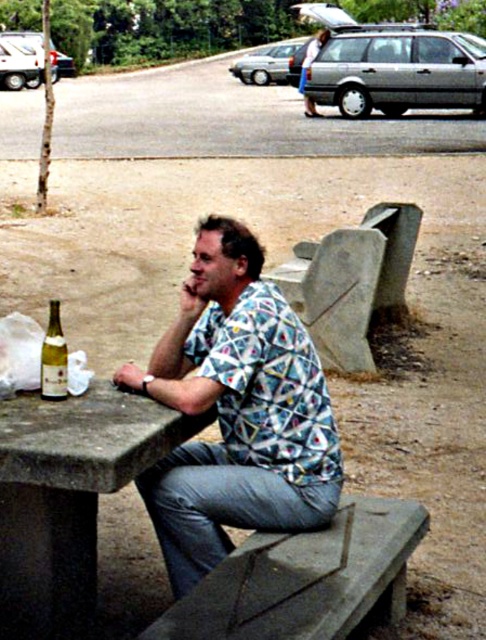
Question: Is concrete table at center bigger than translucent glass bottle at table left?

Choices:
 (A) no
 (B) yes

Answer: (B)

Question: Is printed fabric shirt at center thinner than concrete bench at lower center?

Choices:
 (A) no
 (B) yes

Answer: (B)

Question: Which object appears farthest from the camera in this image?

Choices:
 (A) concrete table at center
 (B) translucent glass bottle at table left
 (C) concrete bench at lower center

Answer: (B)

Question: Does concrete table at center have a larger size compared to concrete bench at lower center?

Choices:
 (A) yes
 (B) no

Answer: (B)

Question: Which object appears closest to the camera in this image?

Choices:
 (A) concrete table at center
 (B) concrete bench at lower center
 (C) printed fabric shirt at center
 (D) translucent glass bottle at table left

Answer: (A)

Question: Estimate the real-world distances between objects in this image. Which object is closer to the concrete bench at lower center?

Choices:
 (A) concrete table at center
 (B) printed fabric shirt at center

Answer: (B)